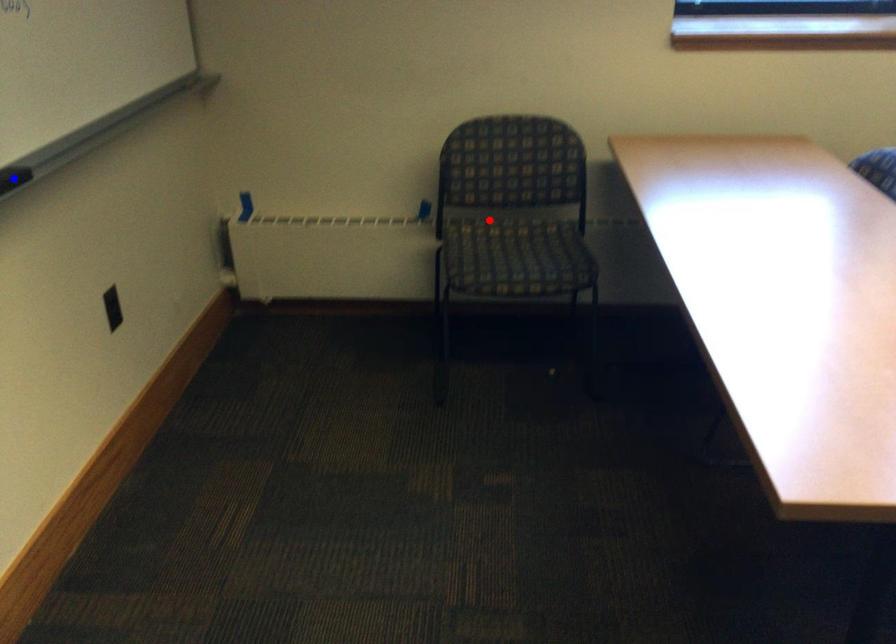
Question: In the image, two points are highlighted. Which point is nearer to the camera? Reply with the corresponding letter.

Choices:
 (A) blue point
 (B) red point

Answer: (A)